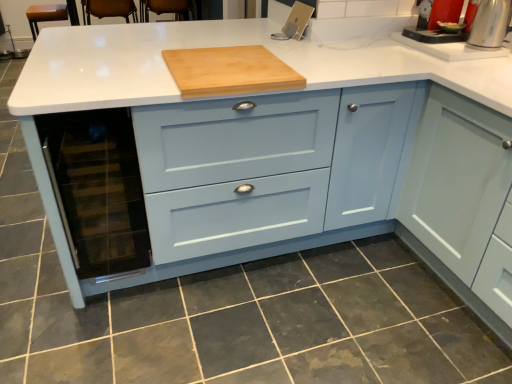
Question: Is natural wood cutting board at center next to white glossy sink at upper right and touching it?

Choices:
 (A) yes
 (B) no

Answer: (B)

Question: Could white glossy sink at upper right be considered to be inside natural wood cutting board at center?

Choices:
 (A) yes
 (B) no

Answer: (B)

Question: Would you say natural wood cutting board at center is outside white glossy sink at upper right?

Choices:
 (A) no
 (B) yes

Answer: (B)

Question: Does natural wood cutting board at center appear on the right side of white glossy sink at upper right?

Choices:
 (A) yes
 (B) no

Answer: (B)

Question: Is natural wood cutting board at center not near white glossy sink at upper right?

Choices:
 (A) no
 (B) yes

Answer: (A)

Question: Is natural wood cutting board at center wider than white glossy sink at upper right?

Choices:
 (A) yes
 (B) no

Answer: (A)

Question: From the image's perspective, is white glossy sink at upper right on dark gray tile at lower center?

Choices:
 (A) yes
 (B) no

Answer: (A)

Question: From a real-world perspective, is white glossy sink at upper right positioned over dark gray tile at lower center based on gravity?

Choices:
 (A) no
 (B) yes

Answer: (B)

Question: Can you confirm if white glossy sink at upper right is smaller than dark gray tile at lower center?

Choices:
 (A) yes
 (B) no

Answer: (A)

Question: Is dark gray tile at lower center at the back of white glossy sink at upper right?

Choices:
 (A) no
 (B) yes

Answer: (A)

Question: Is white glossy sink at upper right surrounding dark gray tile at lower center?

Choices:
 (A) yes
 (B) no

Answer: (B)

Question: From a real-world perspective, is white glossy sink at upper right located beneath dark gray tile at lower center?

Choices:
 (A) no
 (B) yes

Answer: (A)

Question: Is there a large distance between natural wood cutting board at center and satin silver kettle at upper right?

Choices:
 (A) yes
 (B) no

Answer: (A)